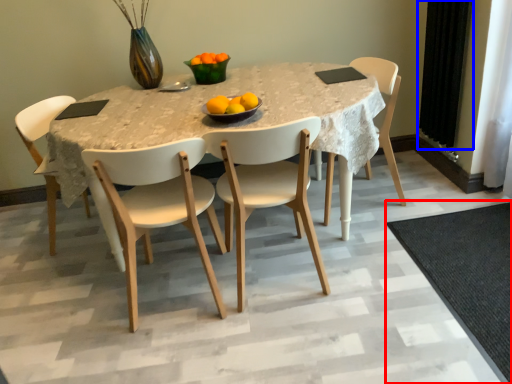
Question: Which object is closer to the camera taking this photo, mat (highlighted by a red box) or curtain (highlighted by a blue box)?

Choices:
 (A) mat
 (B) curtain

Answer: (A)